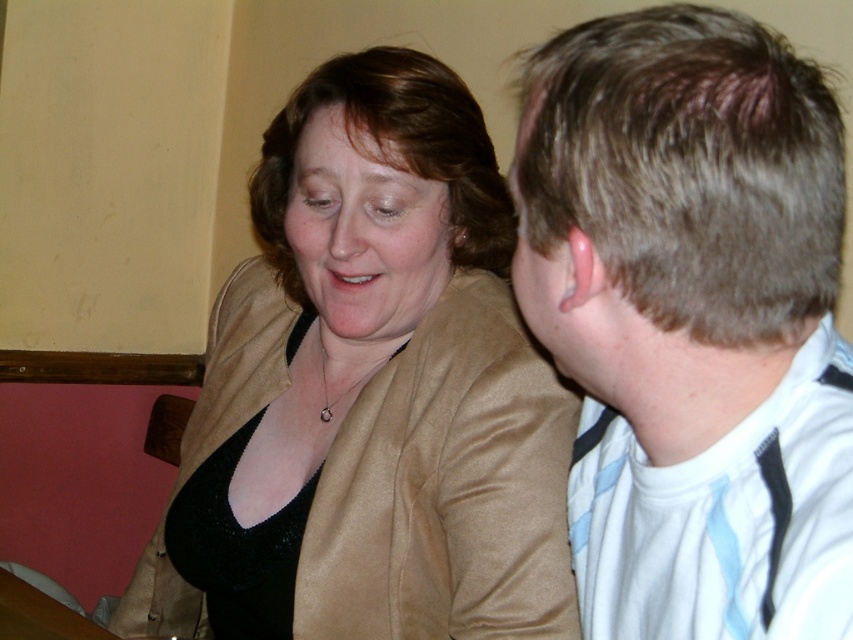
Can you confirm if satin gold jacket at upper left is thinner than white striped shirt at right?

No.

Measure the distance between satin gold jacket at upper left and camera.

They are 33.79 inches apart.

Where is `satin gold jacket at upper left`? This screenshot has width=853, height=640. satin gold jacket at upper left is located at coordinates (369, 394).